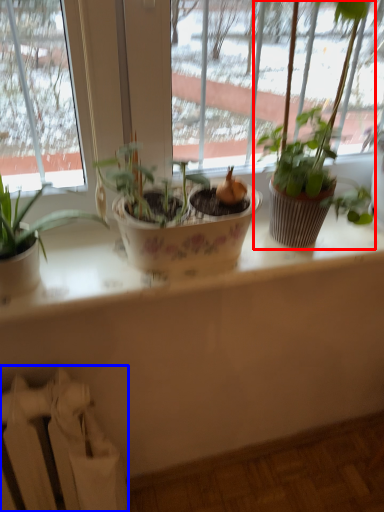
Question: Which of the following is the farthest to the observer, houseplant (highlighted by a red box) or radiator (highlighted by a blue box)?

Choices:
 (A) houseplant
 (B) radiator

Answer: (B)